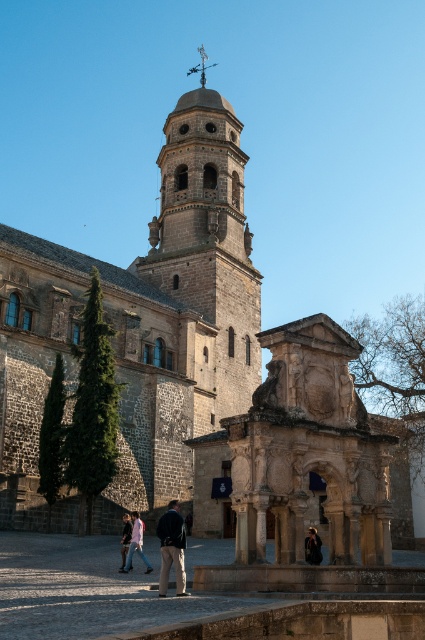
You are a tailor observing the dark blue fabric jacket at center and the dark brown leather jacket at center in the image. Which jacket would require more fabric to cover its height if you were to make a replica?

The dark blue fabric jacket at center is much taller as the dark brown leather jacket at center, so it would require more fabric to cover its height.

You are standing in front of the historic stone structure and want to take a photo. You notice two points marked on the image at coordinates point (79, 268) and point (130, 548). Which point is closer to your camera when taking the photo?

Point (79, 268) is further to the camera than point (130, 548), so the point closer to the camera is point (130, 548).

You are standing in front of the dark gray stone church at center and want to place the light blue denim jacket at lower left next to it. Considering their sizes, which one is wider?

The dark gray stone church at center is wider than the light blue denim jacket at lower left, so the church is wider.